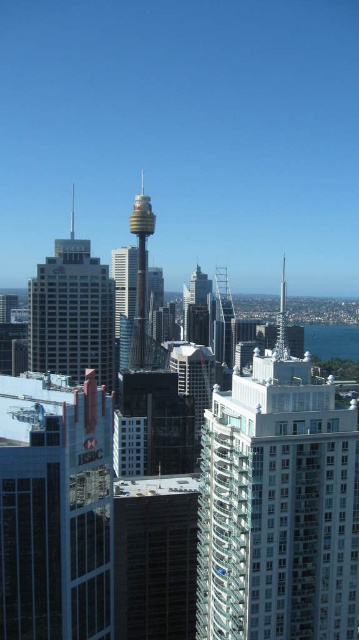
Question: Is glassy reflective building at center further to camera compared to matte gray skyscraper at center?

Choices:
 (A) yes
 (B) no

Answer: (B)

Question: Is glassy reflective building at center to the left of matte gray skyscraper at center from the viewer's perspective?

Choices:
 (A) no
 (B) yes

Answer: (B)

Question: Which object is closer to the camera taking this photo?

Choices:
 (A) matte gray skyscraper at center
 (B) glassy reflective building at center

Answer: (B)

Question: Which point is closer to the camera?

Choices:
 (A) (2, 637)
 (B) (66, 326)

Answer: (A)

Question: Is glassy reflective building at center above matte gray skyscraper at center?

Choices:
 (A) yes
 (B) no

Answer: (B)